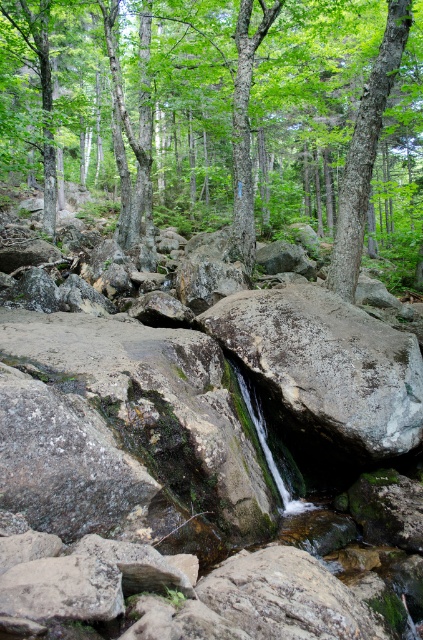
You are a hiker trying to cross the stream in the forest. You see the gray rough rock at center and the smooth bark tree at upper center. Which object is larger in size?

The gray rough rock at center is bigger than the smooth bark tree at upper center according to the description.

You are a hiker who wants to cross the stream safely. You see the green mossy rock at center and the green leafy tree at center. Which object should you step on to avoid getting wet?

The green mossy rock at center is located below green leafy tree at center, so stepping on the green mossy rock at center would allow you to cross the stream safely as it is positioned in the water, providing a stable footing.